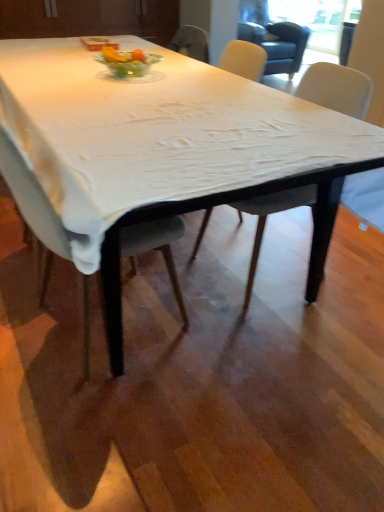
What are the coordinates of `vacant area to the right of matte gray chair at center, marked as the 1th chair in a left-to-right arrangement` in the screenshot? It's located at (223, 345).